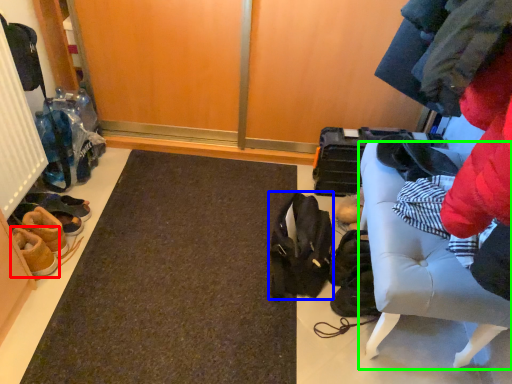
Question: Considering the real-world distances, which object is farthest from footwear (highlighted by a red box)? shoulder bag (highlighted by a blue box) or furniture (highlighted by a green box)?

Choices:
 (A) shoulder bag
 (B) furniture

Answer: (B)